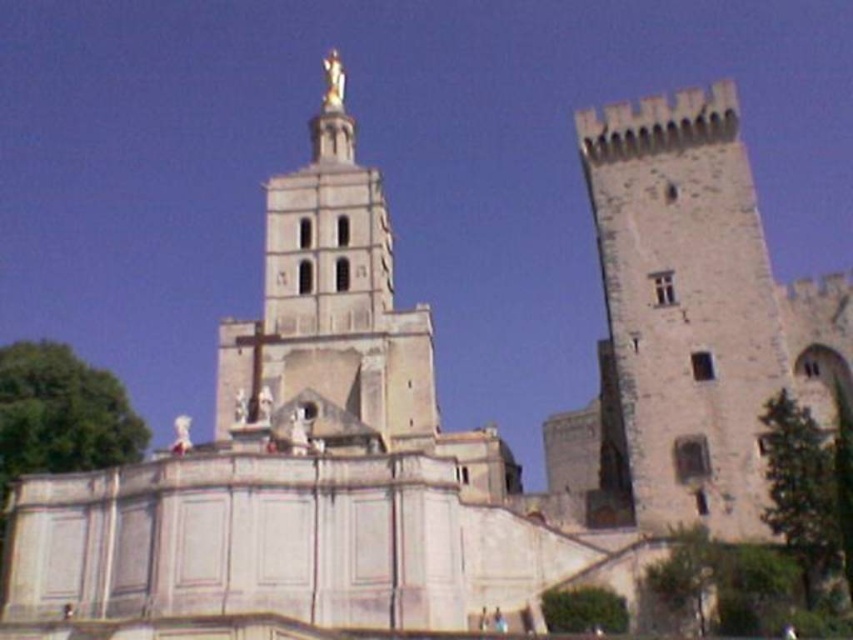
Question: Which object appears closest to the camera in this image?

Choices:
 (A) white marble statue at center
 (B) stone medieval tower at right

Answer: (A)

Question: Which point appears farthest from the camera in this image?

Choices:
 (A) (724, 115)
 (B) (183, 448)

Answer: (A)

Question: Which of the following is the closest to the observer?

Choices:
 (A) (711, 490)
 (B) (177, 419)

Answer: (A)

Question: Does stone medieval tower at right appear on the right side of white marble statue at center?

Choices:
 (A) yes
 (B) no

Answer: (A)

Question: Does stone medieval tower at right have a greater width compared to white marble statue at center?

Choices:
 (A) yes
 (B) no

Answer: (B)

Question: Is stone medieval tower at right below white marble statue at center?

Choices:
 (A) yes
 (B) no

Answer: (B)